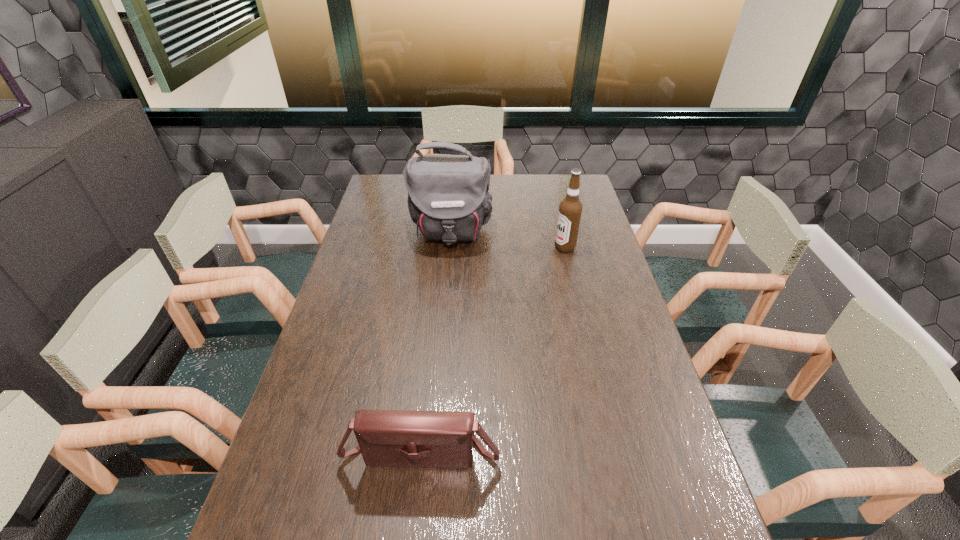
Identify the location of object that is at the right edge. This screenshot has width=960, height=540. (570, 209).

Find the location of a particular element. This screenshot has height=540, width=960. free space at the far edge of the desktop is located at coordinates (506, 180).

Locate an element on the screen. vacant area at the left edge is located at coordinates pyautogui.click(x=325, y=326).

Image resolution: width=960 pixels, height=540 pixels. What are the coordinates of `vacant position at the right edge of the desktop` in the screenshot? It's located at (609, 371).

Where is `free space at the far right corner`? Image resolution: width=960 pixels, height=540 pixels. free space at the far right corner is located at coordinates (585, 191).

The width and height of the screenshot is (960, 540). I want to click on free space between the alcohol and the taller shoulder bag, so 508,240.

Locate an element on the screen. vacant area that lies between the taller shoulder bag and the rightmost object is located at coordinates (508, 240).

Locate an element on the screen. The width and height of the screenshot is (960, 540). the closest object to the rightmost object is located at coordinates (448, 199).

Point out which object is positioned as the second nearest to the nearest object. Please provide its 2D coordinates. Your answer should be formatted as a tuple, i.e. [(x, y)], where the tuple contains the x and y coordinates of a point satisfying the conditions above.

[(570, 209)]

Where is `blank area in the image that satisfies the following two spatial constraints: 1. on the label of the alcohol; 2. on the front flap of the shorter shoulder bag`? The width and height of the screenshot is (960, 540). blank area in the image that satisfies the following two spatial constraints: 1. on the label of the alcohol; 2. on the front flap of the shorter shoulder bag is located at coordinates (612, 448).